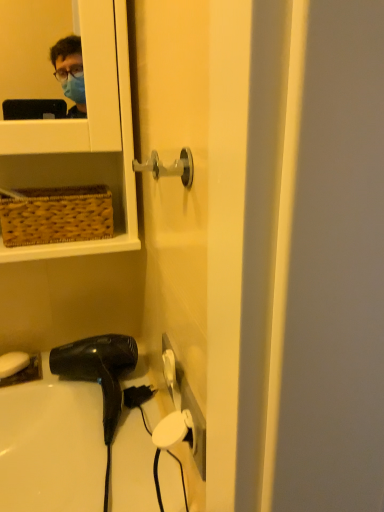
Question: Is white matte soap at lower left in front of or behind black matte hair dryer at lower left in the image?

Choices:
 (A) behind
 (B) front

Answer: (A)

Question: In terms of size, does white matte soap at lower left appear bigger or smaller than black matte hair dryer at lower left?

Choices:
 (A) big
 (B) small

Answer: (B)

Question: Is white matte soap at lower left inside or outside of black matte hair dryer at lower left?

Choices:
 (A) inside
 (B) outside

Answer: (B)

Question: Is black matte hair dryer at lower left wider or thinner than white matte soap at lower left?

Choices:
 (A) wide
 (B) thin

Answer: (A)

Question: From a real-world perspective, is black matte hair dryer at lower left above or below white matte soap at lower left?

Choices:
 (A) above
 (B) below

Answer: (A)

Question: From their relative heights in the image, would you say black matte hair dryer at lower left is taller or shorter than white matte soap at lower left?

Choices:
 (A) tall
 (B) short

Answer: (A)

Question: Is black matte hair dryer at lower left inside the boundaries of white matte soap at lower left, or outside?

Choices:
 (A) outside
 (B) inside

Answer: (A)